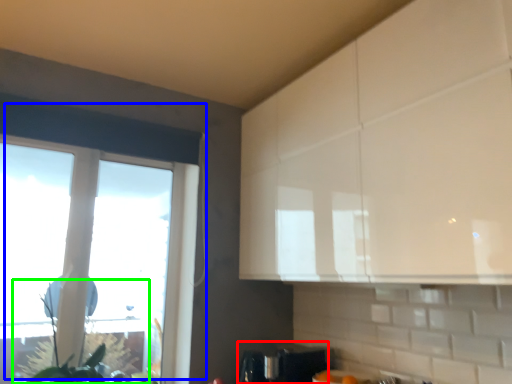
Question: Which is farther away from appliance (highlighted by a red box)? window (highlighted by a blue box) or plant (highlighted by a green box)?

Choices:
 (A) window
 (B) plant

Answer: (B)